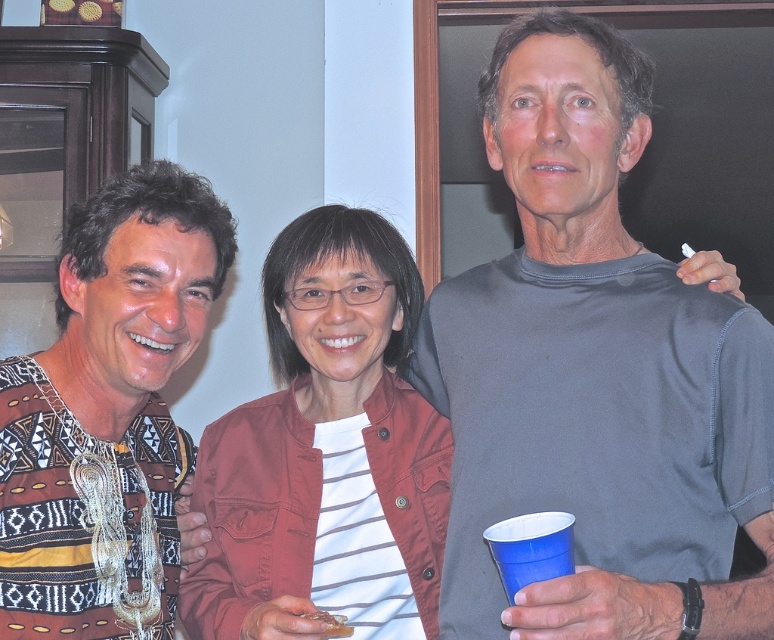
Question: Does patterned fabric shirt at left have a larger size compared to brown crumbly bread at lower center?

Choices:
 (A) no
 (B) yes

Answer: (B)

Question: Where is denim jacket at center located in relation to brown crumbly bread at lower center in the image?

Choices:
 (A) below
 (B) above

Answer: (B)

Question: Which point appears closest to the camera in this image?

Choices:
 (A) (435, 406)
 (B) (146, 216)
 (C) (552, 564)
 (D) (283, 529)

Answer: (C)

Question: Among these points, which one is farthest from the camera?

Choices:
 (A) (468, 602)
 (B) (399, 438)
 (C) (495, 552)

Answer: (B)

Question: Which is nearer to the denim jacket at center?

Choices:
 (A) brown crumbly bread at lower center
 (B) gray matte t-shirt at center
 (C) blue plastic cup at lower right

Answer: (B)

Question: Does gray matte t-shirt at center have a smaller size compared to blue plastic cup at lower right?

Choices:
 (A) yes
 (B) no

Answer: (B)